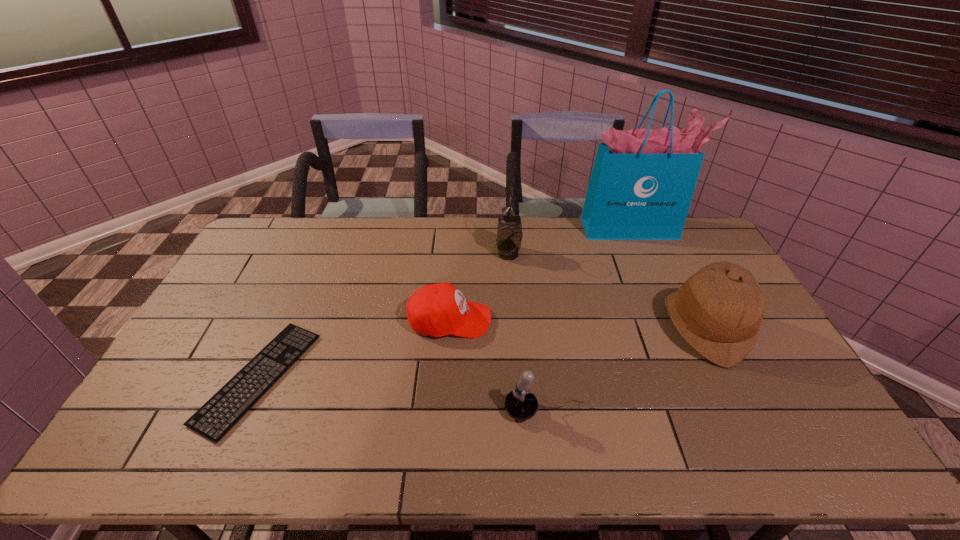
I want to click on object at the left edge, so click(223, 410).

You are a GUI agent. You are given a task and a screenshot of the screen. Output one action in this format:
    pyautogui.click(x=<x>, y=<y>)
    Task: Click on the shopping bag at the right edge
    The width and height of the screenshot is (960, 540).
    Given the screenshot: What is the action you would take?
    pyautogui.click(x=642, y=182)

The width and height of the screenshot is (960, 540). Find the location of `hat that is at the right edge`. hat that is at the right edge is located at coordinates (718, 311).

Locate an element on the screen. The height and width of the screenshot is (540, 960). object at the near left corner is located at coordinates (223, 410).

This screenshot has width=960, height=540. Identify the location of object situated at the far right corner. (642, 182).

Locate an element on the screen. vacant area at the far edge is located at coordinates (401, 220).

Identify the location of vacant region at the near edge of the desktop. This screenshot has width=960, height=540. (607, 434).

The width and height of the screenshot is (960, 540). Find the location of `free space at the left edge of the desktop`. free space at the left edge of the desktop is located at coordinates (208, 318).

The width and height of the screenshot is (960, 540). I want to click on vacant space at the right edge of the desktop, so click(x=767, y=388).

Find the location of a particular element. vacant space at the far left corner of the desktop is located at coordinates (264, 220).